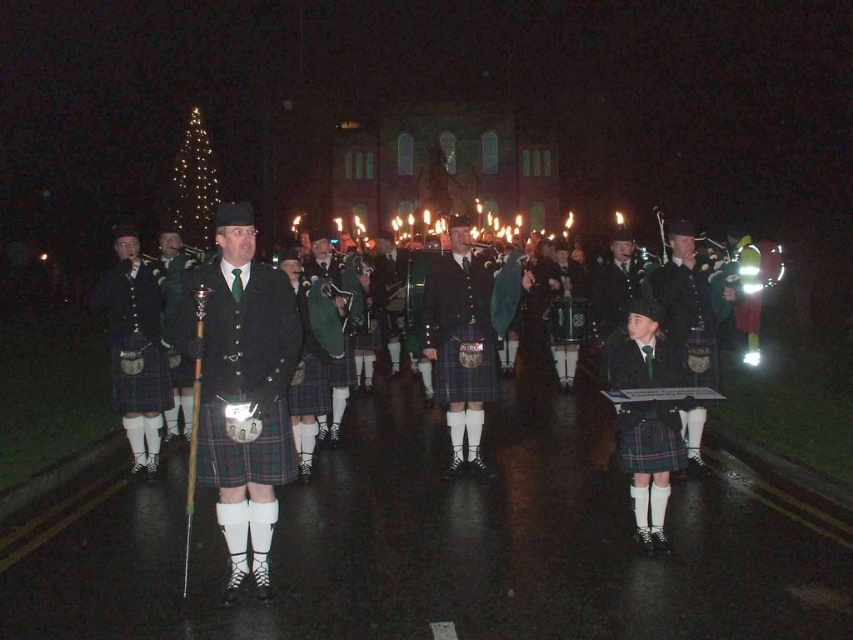
You are a photographer trying to capture the entire scene of the nighttime parade. You notice two points in the image at coordinates point (x=699, y=374) and point (x=192, y=390). Which point is closer to your camera lens?

Point (x=699, y=374) is closer to the camera lens than point (x=192, y=390).

You are a photographer positioned at the front of the scene. You want to capture both the matte black kilt at center and the green wool kilt at center in your photo. Since you can only focus on one subject at a time, which kilt should you focus on to ensure the other is still in the background?

You should focus on the matte black kilt at center because it is in front of the green wool kilt at center, so the green wool kilt at center will naturally be in the background.

You are standing at the point labeled as point (x=173, y=246) and want to walk towards the point labeled as point (x=486, y=362). Based on the scene description, will you be moving towards the building or away from it?

Based on the scene description, point (x=486, y=362) is in front of point (x=173, y=246). Since the building is in the background, moving towards the point (x=486, y=362) means you are moving towards the building.